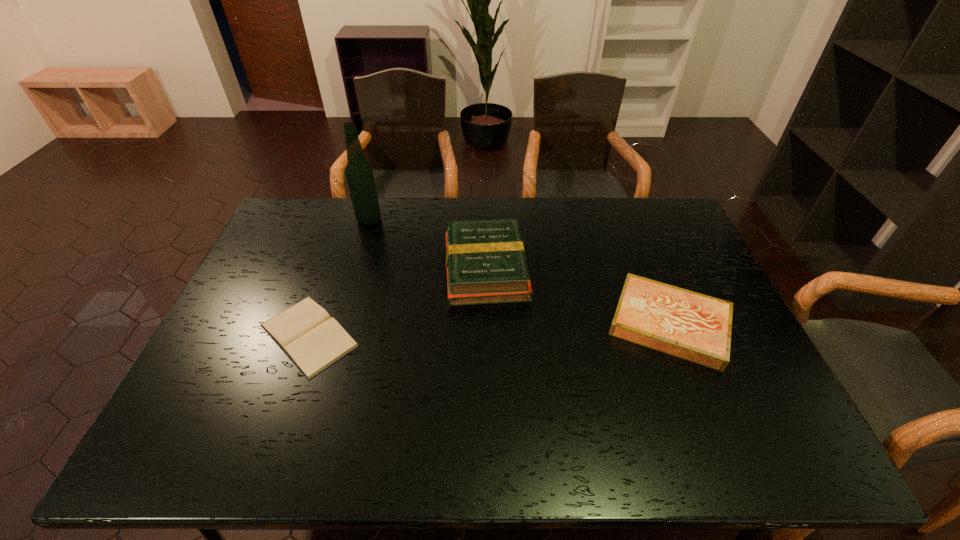
Identify the location of alcohol. The image size is (960, 540). (359, 173).

You are a GUI agent. You are given a task and a screenshot of the screen. Output one action in this format:
    pyautogui.click(x=<x>, y=<y>)
    Task: Click on the tallest object
    The image size is (960, 540).
    Given the screenshot: What is the action you would take?
    pyautogui.click(x=359, y=173)

You are a GUI agent. You are given a task and a screenshot of the screen. Output one action in this format:
    pyautogui.click(x=<x>, y=<y>)
    Task: Click on the left hardback book
    The width and height of the screenshot is (960, 540).
    Given the screenshot: What is the action you would take?
    pyautogui.click(x=485, y=259)

The image size is (960, 540). What are the coordinates of `the third shortest object` in the screenshot? It's located at coord(485,259).

Find the location of a particular element. the shorter hardback book is located at coordinates (695, 327).

Identify the location of the right hardback book. Image resolution: width=960 pixels, height=540 pixels. (695, 327).

You are a GUI agent. You are given a task and a screenshot of the screen. Output one action in this format:
    pyautogui.click(x=<x>, y=<y>)
    Task: Click on the Bible
    
    Given the screenshot: What is the action you would take?
    pyautogui.click(x=313, y=340)

Locate an element on the screen. free point located 0.170m on the left of the farthest object is located at coordinates (309, 220).

At what (x,y) coordinates should I click in order to perform the action: click on vacant space situated on the front of the left hardback book. Please return your answer as a coordinate pair (x, y). The width and height of the screenshot is (960, 540). Looking at the image, I should click on (487, 361).

I want to click on free spot located on the back of the rightmost object, so click(x=643, y=260).